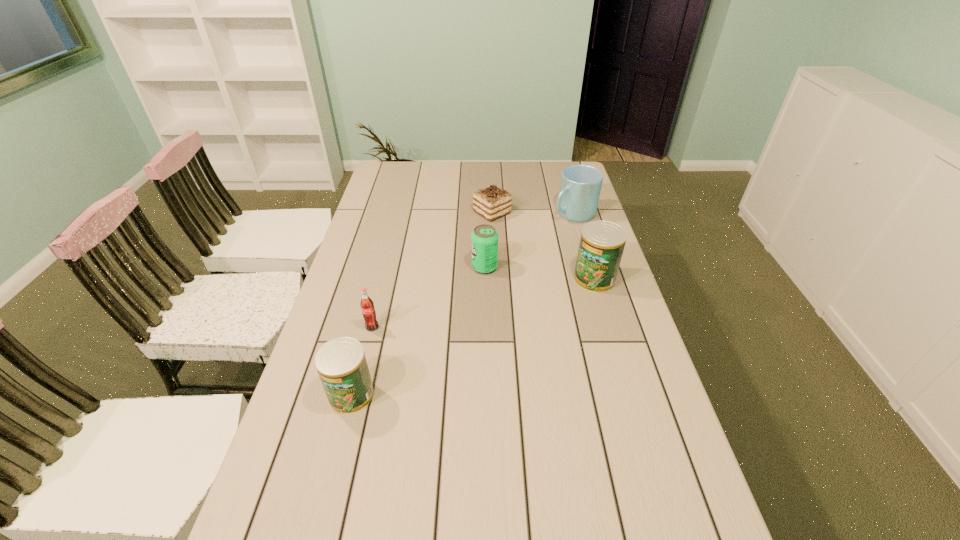
Find the location of `mug situated at the right edge`. mug situated at the right edge is located at coordinates (580, 187).

Find the location of `vacant space at the far edge`. vacant space at the far edge is located at coordinates (436, 181).

The image size is (960, 540). I want to click on free space at the left edge, so click(x=347, y=276).

I want to click on vacant space at the right edge of the desktop, so click(x=553, y=204).

This screenshot has height=540, width=960. In the image, there is a desktop. What are the coordinates of `vacant space at the far left corner` in the screenshot? It's located at (391, 181).

The image size is (960, 540). I want to click on blank area at the far right corner, so click(546, 179).

The image size is (960, 540). I want to click on free space between the mug and the nearer can, so click(x=463, y=304).

What are the coordinates of `free space that is in between the chocolate cake and the farther can` in the screenshot? It's located at (543, 246).

Locate an element on the screen. The height and width of the screenshot is (540, 960). vacant point located between the right soda bottle and the right can is located at coordinates (540, 273).

You are a GUI agent. You are given a task and a screenshot of the screen. Output one action in this format:
    pyautogui.click(x=<x>, y=<y>)
    Task: Click on the free spot between the mug and the fifth farthest object
    The height and width of the screenshot is (540, 960).
    Given the screenshot: What is the action you would take?
    pyautogui.click(x=473, y=271)